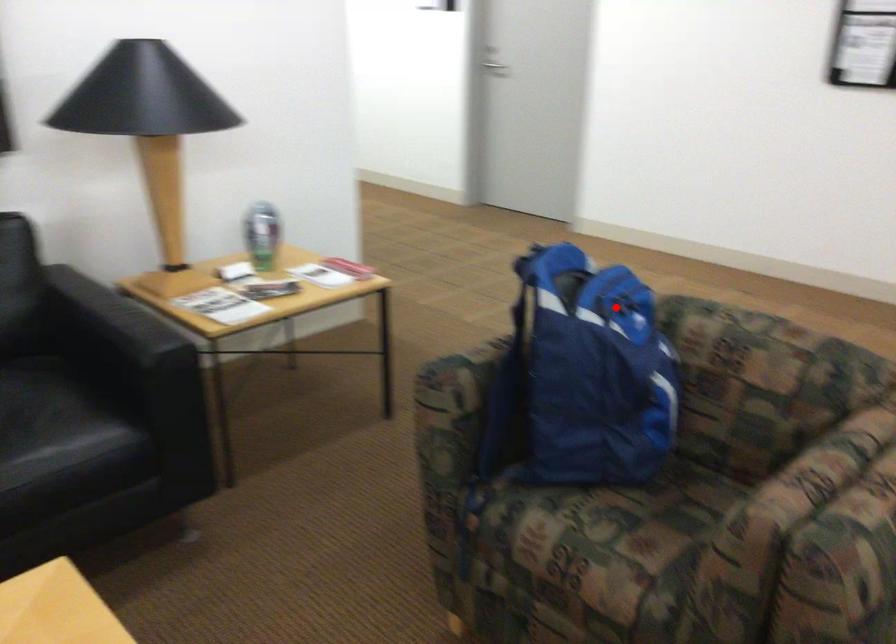
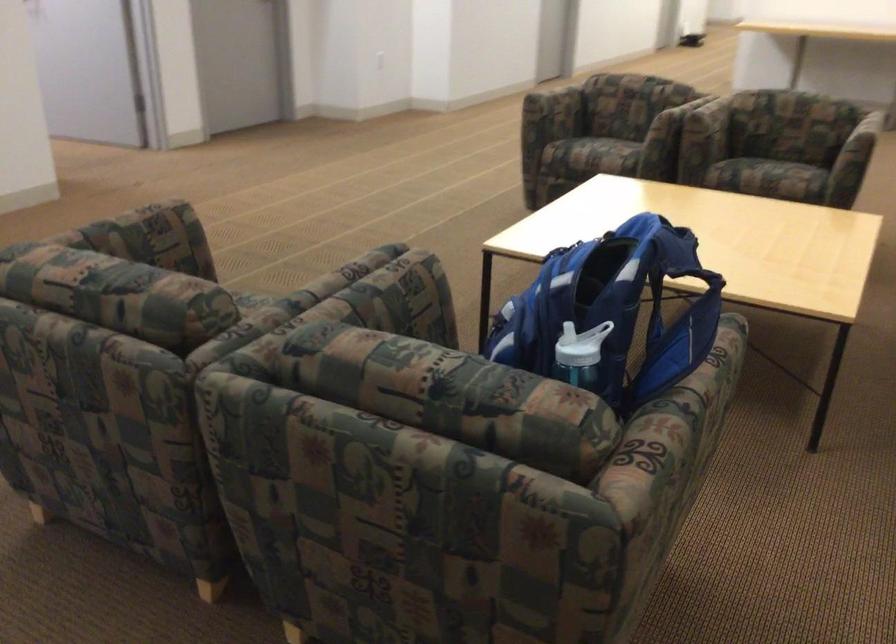
In the second image, find the point that corresponds to the highlighted location in the first image.

(574, 348)